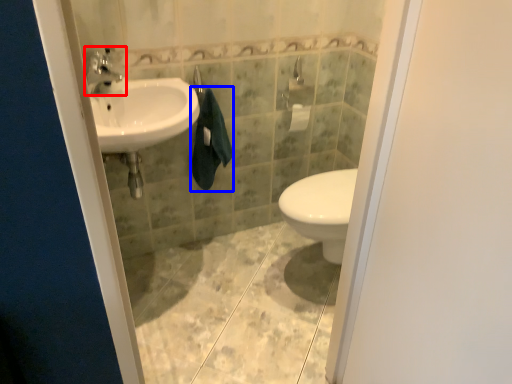
Question: Which object is further to the camera taking this photo, tap (highlighted by a red box) or bath towel (highlighted by a blue box)?

Choices:
 (A) tap
 (B) bath towel

Answer: (B)